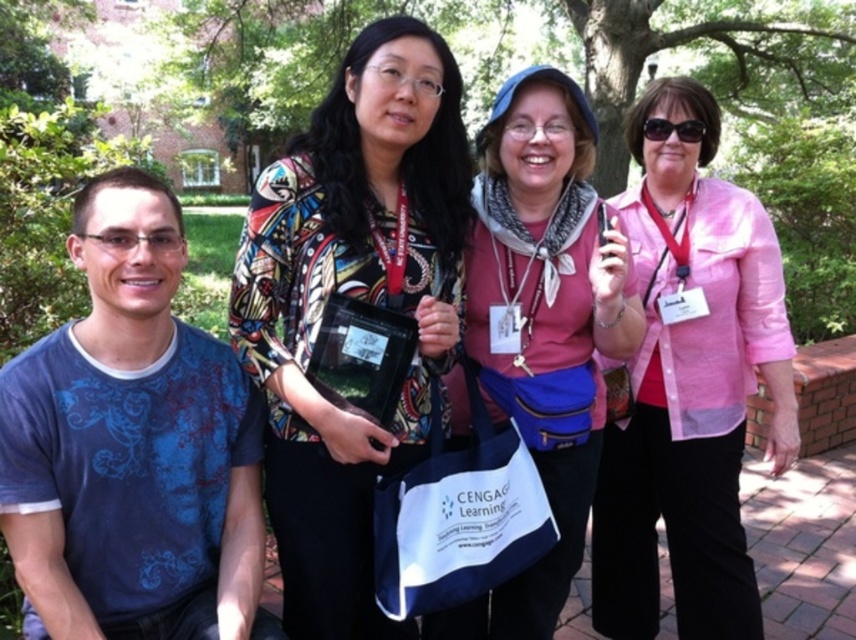
In the scene shown: You are a photographer trying to capture a detail shot of the pink sheer blouse at center and the black plastic sunglasses at upper center. Which object should you focus on first if you want to start with the one closer to the camera?

The black plastic sunglasses at upper center should be focused on first since it is closer to the camera than the pink sheer blouse at center.

You are a photographer holding a camera. You want to place your pink fabric purse at center in a position where it won t be in the shot. Given that the camera and the purse are 2.26 meters apart, can you estimate if placing the purse 2 meters behind the camera would keep it out of the frame?

The pink fabric purse at center is 2.26 meters away from the camera. If you place it 2 meters behind the camera, it would be 2 meters away from the camera, which is closer than the original distance. This might still leave it within the frame. To ensure it is out of the shot, you need to place it further than 2.26 meters behind the camera.

You are organizing a photo shoot and need to ensure that the pink fabric purse at center and the black plastic bag at center are positioned correctly. According to the scene description, which object is located to the right of the other?

The pink fabric purse at center is to the right of the black plastic bag at center.